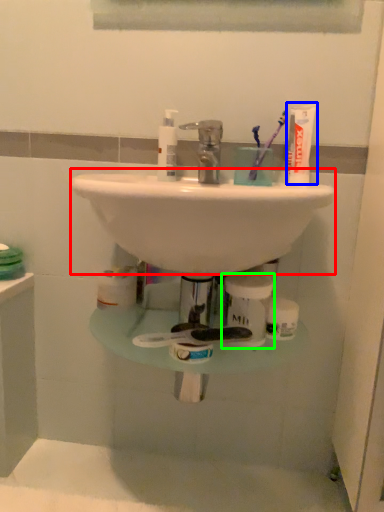
Question: Which is nearer to the sink (highlighted by a red box)? toothpaste (highlighted by a blue box) or toiletry (highlighted by a green box).

Choices:
 (A) toothpaste
 (B) toiletry

Answer: (B)